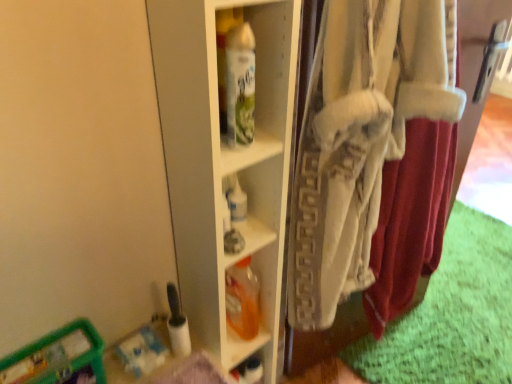
At what (x,y) coordinates should I click in order to perform the action: click on white glossy shelf at center. Please return your answer as a coordinate pair (x, y). Looking at the image, I should click on (225, 163).

Measure the distance between point (251,37) and camera.

Point (251,37) and camera are 28.15 inches apart.

What do you see at coordinates (240, 84) in the screenshot? I see `white glossy spray can at center, the 2th bottle when ordered from bottom to top` at bounding box center [240, 84].

Identify the location of white cotton underclothes at right. This screenshot has width=512, height=384. (360, 137).

The width and height of the screenshot is (512, 384). What do you see at coordinates (242, 299) in the screenshot? I see `translucent orange plastic bottle at center, acting as the first bottle starting from the bottom` at bounding box center [242, 299].

Identify the location of white glossy shelf at center. The height and width of the screenshot is (384, 512). (225, 163).

Is translucent orange plastic bottle at center, which ranks as the second bottle in front-to-back order, aimed at white glossy spray can at center, placed as the 1th bottle when sorted from top to bottom?

No.

From the image's perspective, between translucent orange plastic bottle at center, the 1th bottle when ordered from back to front, and white glossy spray can at center, placed as the 1th bottle when sorted from top to bottom, who is located below?

translucent orange plastic bottle at center, the 1th bottle when ordered from back to front.

Find the location of `bottle that appears below the white glossy spray can at center, placed as the 1th bottle when sorted from top to bottom (from a real-world perspective)`. bottle that appears below the white glossy spray can at center, placed as the 1th bottle when sorted from top to bottom (from a real-world perspective) is located at coordinates (242, 299).

Which object is positioned more to the right, translucent orange plastic bottle at center, the 2th bottle positioned from the top, or white glossy spray can at center, placed as the 1th bottle when sorted from top to bottom?

Positioned to the right is translucent orange plastic bottle at center, the 2th bottle positioned from the top.

Looking at this image, who is smaller, translucent plastic container at lower left or white glossy spray can at center, the 2th bottle when ordered from bottom to top?

With smaller size is white glossy spray can at center, the 2th bottle when ordered from bottom to top.

Is translucent plastic container at lower left positioned far away from white glossy spray can at center, the 2th bottle in the back-to-front sequence?

translucent plastic container at lower left is actually quite close to white glossy spray can at center, the 2th bottle in the back-to-front sequence.

Could white glossy spray can at center, placed as the 1th bottle when sorted from top to bottom, be considered to be inside translucent plastic container at lower left?

Definitely not — white glossy spray can at center, placed as the 1th bottle when sorted from top to bottom, is not inside translucent plastic container at lower left.

Could you tell me if translucent plastic container at lower left is turned towards white glossy spray can at center, placed as the 1th bottle when sorted from top to bottom?

No, translucent plastic container at lower left is not facing towards white glossy spray can at center, placed as the 1th bottle when sorted from top to bottom.

I want to click on the 1st bottle behind the white glossy shelf at center, counting from the anchor's position, so click(240, 84).

Which of these two, white glossy spray can at center, the 2th bottle when ordered from bottom to top, or white glossy shelf at center, is wider?

With larger width is white glossy shelf at center.

From a real-world perspective, is white glossy spray can at center, placed as the 1th bottle when sorted from front to back, physically located above or below white glossy shelf at center?

In terms of real-world spatial position, white glossy spray can at center, placed as the 1th bottle when sorted from front to back, is above white glossy shelf at center.

In terms of size, does translucent orange plastic bottle at center, the 2th bottle positioned from the top, appear bigger or smaller than translucent plastic container at lower left?

In the image, translucent orange plastic bottle at center, the 2th bottle positioned from the top, appears to be smaller than translucent plastic container at lower left.

From their relative heights in the image, would you say translucent orange plastic bottle at center, acting as the first bottle starting from the bottom, is taller or shorter than translucent plastic container at lower left?

Considering their sizes, translucent orange plastic bottle at center, acting as the first bottle starting from the bottom, has more height than translucent plastic container at lower left.

Is translucent orange plastic bottle at center, the 2th bottle positioned from the top, placed right next to translucent plastic container at lower left?

There is a gap between translucent orange plastic bottle at center, the 2th bottle positioned from the top, and translucent plastic container at lower left.

Which point is more distant from viewer, (x=229, y=316) or (x=70, y=371)?

The point (x=229, y=316) is farther from the camera.

Who is more distant, white glossy shelf at center or translucent orange plastic bottle at center, the 1th bottle when ordered from back to front?

translucent orange plastic bottle at center, the 1th bottle when ordered from back to front, is more distant.

Considering the relative sizes of white glossy shelf at center and translucent orange plastic bottle at center, the 1th bottle when ordered from back to front, in the image provided, is white glossy shelf at center taller than translucent orange plastic bottle at center, the 1th bottle when ordered from back to front,?

Indeed, white glossy shelf at center has a greater height compared to translucent orange plastic bottle at center, the 1th bottle when ordered from back to front.

Are white glossy shelf at center and translucent orange plastic bottle at center, the 1th bottle when ordered from back to front, far apart?

No.

Looking at their sizes, would you say white glossy shelf at center is wider or thinner than translucent orange plastic bottle at center, the 1th bottle when ordered from back to front?

In the image, white glossy shelf at center appears to be wider than translucent orange plastic bottle at center, the 1th bottle when ordered from back to front.

Is white cotton underclothes at right positioned beyond the bounds of white glossy spray can at center, placed as the 1th bottle when sorted from front to back?

Yes, white cotton underclothes at right is not within white glossy spray can at center, placed as the 1th bottle when sorted from front to back.

Does white cotton underclothes at right turn towards white glossy spray can at center, the 2th bottle in the back-to-front sequence?

No, white cotton underclothes at right is not aimed at white glossy spray can at center, the 2th bottle in the back-to-front sequence.

Based on the photo, does white cotton underclothes at right appear on the right side of white glossy spray can at center, placed as the 1th bottle when sorted from top to bottom?

Yes, white cotton underclothes at right is to the right of white glossy spray can at center, placed as the 1th bottle when sorted from top to bottom.

Between white cotton underclothes at right and translucent plastic container at lower left, which one appears on the left side from the viewer's perspective?

Positioned to the left is translucent plastic container at lower left.

From the image's perspective, relative to translucent plastic container at lower left, is white cotton underclothes at right above or below?

Based on their image positions, white cotton underclothes at right is located above translucent plastic container at lower left.

Considering the relative sizes of white cotton underclothes at right and translucent plastic container at lower left in the image provided, is white cotton underclothes at right smaller than translucent plastic container at lower left?

No, white cotton underclothes at right is not smaller than translucent plastic container at lower left.

Is white cotton underclothes at right shorter than translucent plastic container at lower left?

No, white cotton underclothes at right is not shorter than translucent plastic container at lower left.

Where is `bottle on the left of translucent orange plastic bottle at center, which ranks as the second bottle in front-to-back order`? This screenshot has height=384, width=512. bottle on the left of translucent orange plastic bottle at center, which ranks as the second bottle in front-to-back order is located at coordinates (240, 84).

What are the coordinates of `bottle above the translucent plastic container at lower left (from a real-world perspective)` in the screenshot? It's located at coord(240,84).

Considering their positions, is white glossy spray can at center, placed as the 1th bottle when sorted from front to back, positioned closer to translucent orange plastic bottle at center, which ranks as the second bottle in front-to-back order, than white cotton underclothes at right?

white cotton underclothes at right.

In the scene shown: Looking at the image, which one is located closer to translucent orange plastic bottle at center, which ranks as the second bottle in front-to-back order, white cotton underclothes at right or white glossy shelf at center?

white glossy shelf at center.

From the picture: From the image, which object appears to be nearer to white glossy spray can at center, the 2th bottle in the back-to-front sequence, white glossy shelf at center or translucent orange plastic bottle at center, the 1th bottle when ordered from back to front?

The object closer to white glossy spray can at center, the 2th bottle in the back-to-front sequence, is white glossy shelf at center.

Estimate the real-world distances between objects in this image. Which object is closer to white glossy shelf at center, white glossy spray can at center, placed as the 1th bottle when sorted from top to bottom, or translucent orange plastic bottle at center, the 2th bottle positioned from the top?

white glossy spray can at center, placed as the 1th bottle when sorted from top to bottom.

When comparing their distances from translucent orange plastic bottle at center, the 1th bottle when ordered from back to front, does white glossy spray can at center, the 2th bottle when ordered from bottom to top, or white glossy shelf at center seem further?

Based on the image, white glossy spray can at center, the 2th bottle when ordered from bottom to top, appears to be further to translucent orange plastic bottle at center, the 1th bottle when ordered from back to front.

Estimate the real-world distances between objects in this image. Which object is closer to white cotton underclothes at right, translucent orange plastic bottle at center, which ranks as the second bottle in front-to-back order, or white glossy spray can at center, placed as the 1th bottle when sorted from front to back?

translucent orange plastic bottle at center, which ranks as the second bottle in front-to-back order, is closer to white cotton underclothes at right.

Looking at the image, which one is located further to white glossy spray can at center, the 2th bottle in the back-to-front sequence, translucent orange plastic bottle at center, acting as the first bottle starting from the bottom, or white glossy shelf at center?

Among the two, translucent orange plastic bottle at center, acting as the first bottle starting from the bottom, is located further to white glossy spray can at center, the 2th bottle in the back-to-front sequence.

From the image, which object appears to be farther from translucent orange plastic bottle at center, acting as the first bottle starting from the bottom, white glossy shelf at center or white cotton underclothes at right?

The object further to translucent orange plastic bottle at center, acting as the first bottle starting from the bottom, is white cotton underclothes at right.

Where is `shelf between white glossy spray can at center, placed as the 1th bottle when sorted from front to back, and translucent orange plastic bottle at center, which ranks as the second bottle in front-to-back order, in the up-down direction`? Image resolution: width=512 pixels, height=384 pixels. shelf between white glossy spray can at center, placed as the 1th bottle when sorted from front to back, and translucent orange plastic bottle at center, which ranks as the second bottle in front-to-back order, in the up-down direction is located at coordinates (225, 163).

Locate an element on the screen. shelf between white glossy spray can at center, placed as the 1th bottle when sorted from top to bottom, and translucent plastic container at lower left from top to bottom is located at coordinates (225, 163).

Image resolution: width=512 pixels, height=384 pixels. In order to click on shelf situated between translucent plastic container at lower left and white cotton underclothes at right from left to right in this screenshot , I will do `click(225, 163)`.

The image size is (512, 384). Find the location of `bottle positioned between white cotton underclothes at right and translucent orange plastic bottle at center, the 1th bottle when ordered from back to front, from near to far`. bottle positioned between white cotton underclothes at right and translucent orange plastic bottle at center, the 1th bottle when ordered from back to front, from near to far is located at coordinates (240, 84).